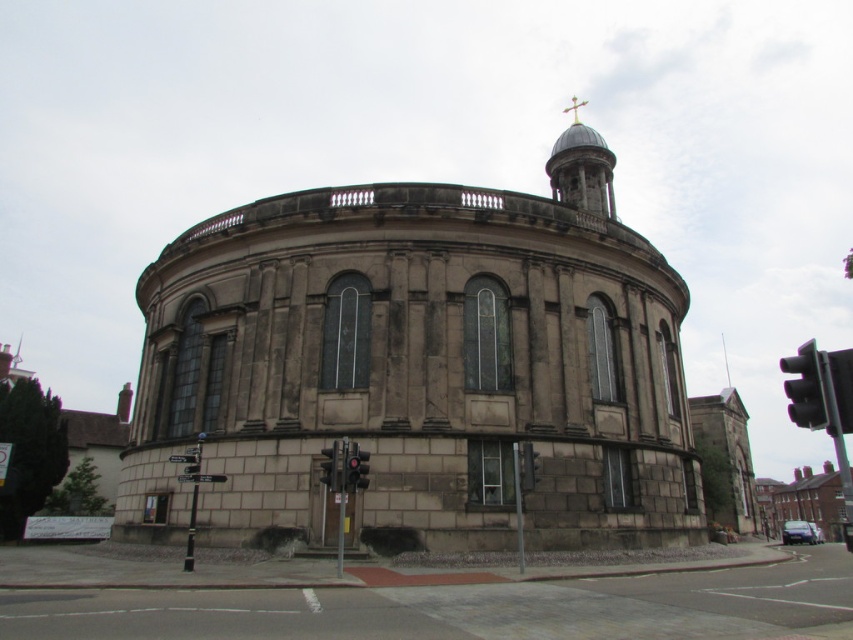
You are standing in front of the circular building and notice two points marked on its facade. The first point is at coordinates point [316,324] and the second at point [323,464]. Which point is closer to you?

Point [316,324] is further to the camera than point [323,464], so the point closer to you is point [323,464].

You are a pedestrian standing at the crosswalk and see the black glass traffic light at right and the metallic traffic light at lower center. Which traffic light is bigger?

The black glass traffic light at right is larger in size than the metallic traffic light at lower center.